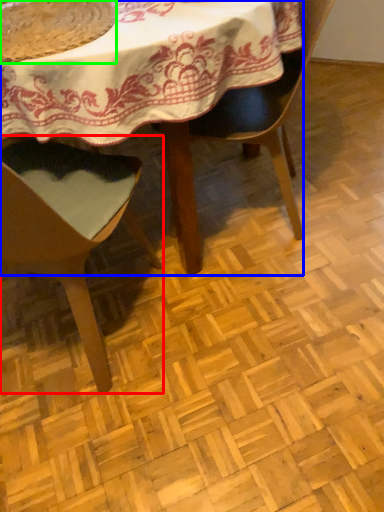
Question: Which object is positioned closest to chair (highlighted by a red box)? Select from table (highlighted by a blue box) and food (highlighted by a green box).

Choices:
 (A) table
 (B) food

Answer: (A)